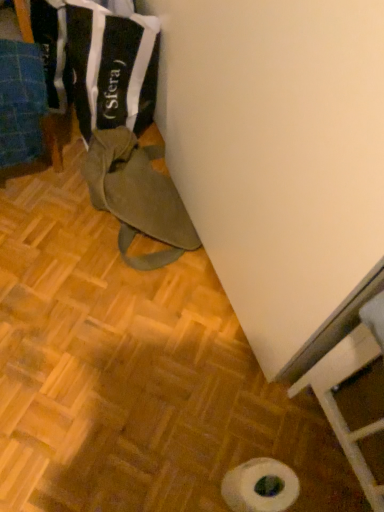
Question: From the image's perspective, is black fabric bag at upper left located beneath olive green canvas bag at lower left?

Choices:
 (A) no
 (B) yes

Answer: (A)

Question: Could you tell me if black fabric bag at upper left is facing olive green canvas bag at lower left?

Choices:
 (A) yes
 (B) no

Answer: (A)

Question: Considering the relative sizes of black fabric bag at upper left and olive green canvas bag at lower left in the image provided, is black fabric bag at upper left thinner than olive green canvas bag at lower left?

Choices:
 (A) yes
 (B) no

Answer: (B)

Question: Is black fabric bag at upper left wider than olive green canvas bag at lower left?

Choices:
 (A) yes
 (B) no

Answer: (A)

Question: Is black fabric bag at upper left outside of olive green canvas bag at lower left?

Choices:
 (A) yes
 (B) no

Answer: (A)

Question: From a real-world perspective, is blue fabric at left, positioned as the first wood in left-to-right order, physically located above or below olive green canvas bag at lower left?

Choices:
 (A) below
 (B) above

Answer: (B)

Question: Is blue fabric at left, positioned as the first wood in left-to-right order, inside the boundaries of olive green canvas bag at lower left, or outside?

Choices:
 (A) inside
 (B) outside

Answer: (B)

Question: From the image's perspective, is blue fabric at left, positioned as the first wood in left-to-right order, above or below olive green canvas bag at lower left?

Choices:
 (A) below
 (B) above

Answer: (B)

Question: Is point (46, 117) closer or farther from the camera than point (122, 225)?

Choices:
 (A) closer
 (B) farther

Answer: (B)

Question: Do you think olive green canvas bag at lower left is within white matte toilet paper at lower center, or outside of it?

Choices:
 (A) outside
 (B) inside

Answer: (A)

Question: From a real-world perspective, is olive green canvas bag at lower left positioned above or below white matte toilet paper at lower center?

Choices:
 (A) below
 (B) above

Answer: (B)

Question: Does point (97, 139) appear closer or farther from the camera than point (254, 501)?

Choices:
 (A) closer
 (B) farther

Answer: (B)

Question: Is olive green canvas bag at lower left wider or thinner than white matte toilet paper at lower center?

Choices:
 (A) thin
 (B) wide

Answer: (B)

Question: Is black fabric bag at upper left spatially inside brown matte bag at lower left, arranged as the 2th wood when viewed from the left, or outside of it?

Choices:
 (A) inside
 (B) outside

Answer: (B)

Question: From the image's perspective, is black fabric bag at upper left positioned above or below brown matte bag at lower left, arranged as the 2th wood when viewed from the left?

Choices:
 (A) above
 (B) below

Answer: (A)